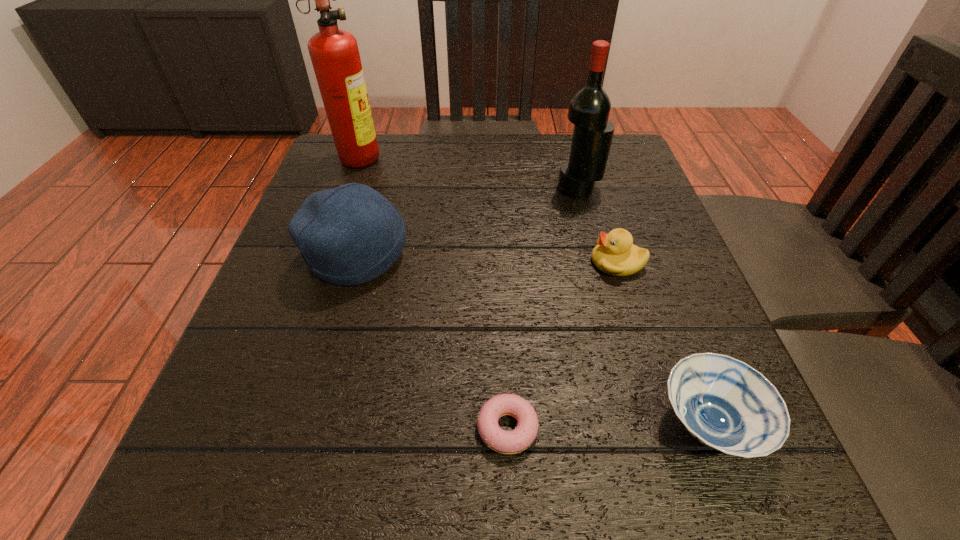
Find the location of a particular element. vacant space at the near edge is located at coordinates (650, 475).

The width and height of the screenshot is (960, 540). Find the location of `free space at the left edge of the desktop`. free space at the left edge of the desktop is located at coordinates (263, 301).

Where is `vacant region at the right edge of the desktop`? This screenshot has width=960, height=540. vacant region at the right edge of the desktop is located at coordinates (648, 211).

This screenshot has width=960, height=540. In the image, there is a desktop. Find the location of `vacant space at the far left corner`. vacant space at the far left corner is located at coordinates (328, 147).

In the image, there is a desktop. Identify the location of vacant space at the near left corner. The image size is (960, 540). (186, 456).

Identify the location of free space at the far right corner. (615, 138).

Find the location of a particular element. The image size is (960, 540). free space at the near right corner of the desktop is located at coordinates (691, 509).

Where is `free area in between the doughnut and the fifth nearest object`? This screenshot has height=540, width=960. free area in between the doughnut and the fifth nearest object is located at coordinates click(x=543, y=308).

The height and width of the screenshot is (540, 960). What are the coordinates of `vacant area between the third tallest object and the second tallest object` in the screenshot? It's located at (468, 221).

Locate an element on the screen. The height and width of the screenshot is (540, 960). empty location between the wine bottle and the duckling is located at coordinates (598, 225).